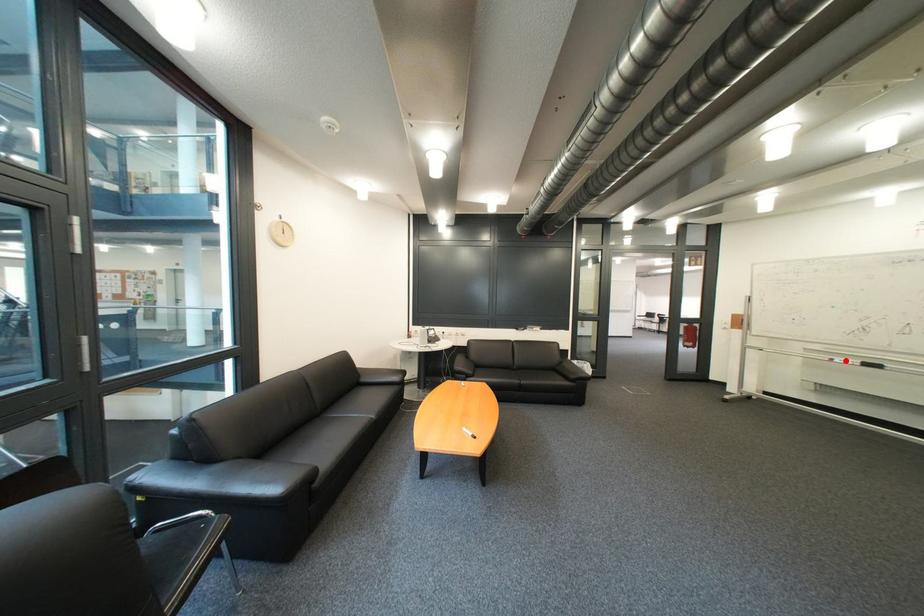
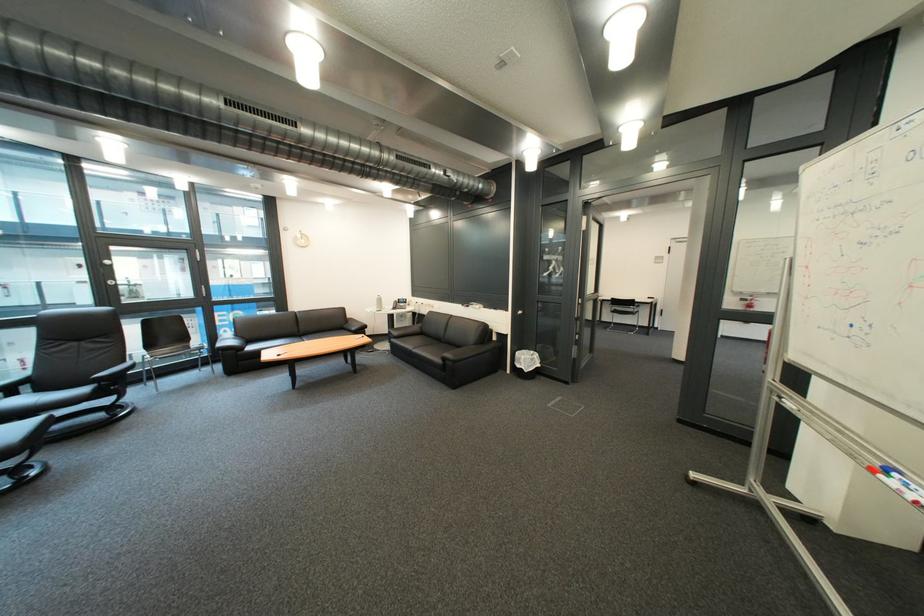
Locate, in the second image, the point that corresponds to the highlighted location in the first image.

(901, 472)